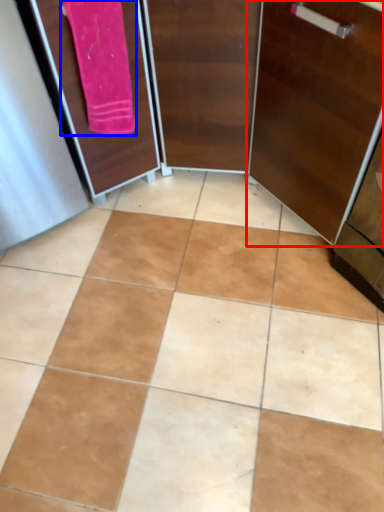
Question: Among these objects, which one is farthest to the camera, door (highlighted by a red box) or bath towel (highlighted by a blue box)?

Choices:
 (A) door
 (B) bath towel

Answer: (B)